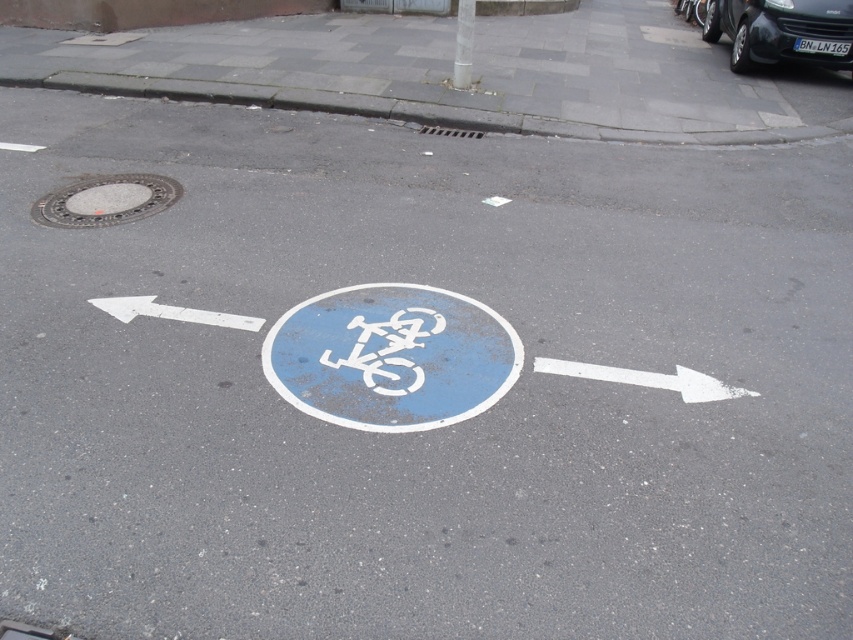
Question: Is white matte bicycle symbol at center further to camera compared to white painted arrow at left?

Choices:
 (A) yes
 (B) no

Answer: (B)

Question: Considering the real-world distances, which object is farthest from the white matte bicycle symbol at center?

Choices:
 (A) white painted arrow at left
 (B) white matte arrow at center

Answer: (B)

Question: From the image, what is the correct spatial relationship of white painted bike lane at center in relation to white painted arrow at left?

Choices:
 (A) above
 (B) below

Answer: (B)

Question: Based on their relative distances, which object is nearer to the white matte arrow at center?

Choices:
 (A) smooth metallic manhole cover at upper left
 (B) white painted arrow at left
 (C) white painted bike lane at center
 (D) blue painted bicycle sign at center

Answer: (C)

Question: Can you confirm if white painted bike lane at center is thinner than smooth metallic manhole cover at upper left?

Choices:
 (A) no
 (B) yes

Answer: (A)

Question: Which of the following is the farthest from the observer?

Choices:
 (A) white matte arrow at center
 (B) black metallic car at upper right
 (C) white matte bicycle symbol at center

Answer: (B)